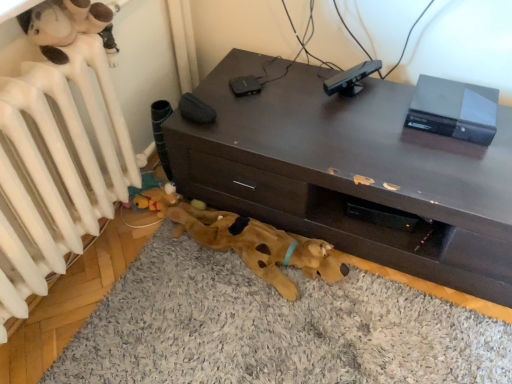
Where is `vacant space situated on the left part of brown plush dog at lower center`? This screenshot has width=512, height=384. vacant space situated on the left part of brown plush dog at lower center is located at coordinates [143, 301].